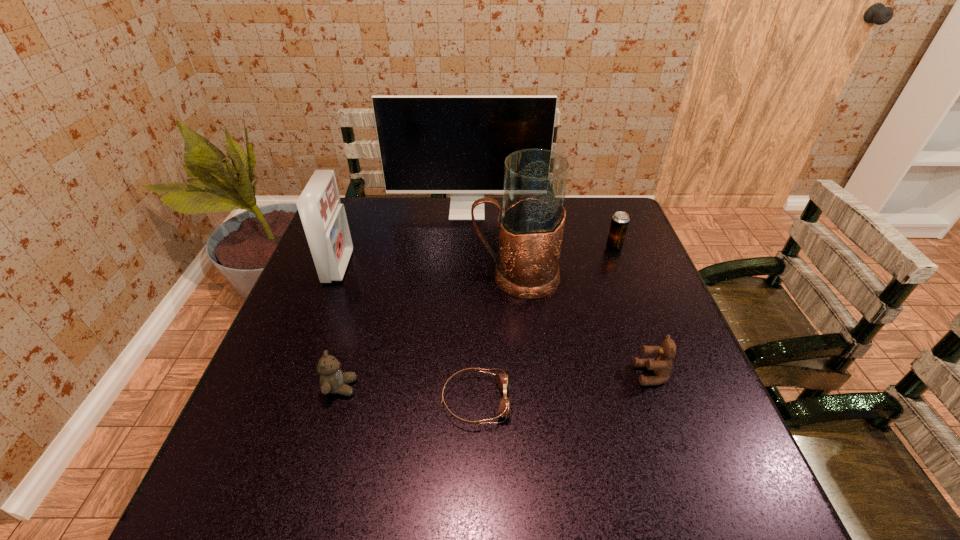
In order to click on the farthest object in this screenshot , I will do `click(428, 144)`.

This screenshot has width=960, height=540. I want to click on pitcher, so click(x=531, y=227).

Locate an element on the screen. The height and width of the screenshot is (540, 960). the leftmost object is located at coordinates coord(323,217).

Locate an element on the screen. This screenshot has height=540, width=960. the first-aid kit is located at coordinates (323, 217).

Find the location of `beer can`. beer can is located at coordinates (620, 220).

I want to click on the right teddy bear, so click(662, 364).

This screenshot has height=540, width=960. I want to click on the left teddy bear, so [332, 379].

The image size is (960, 540). Identify the location of goggles. (502, 380).

The height and width of the screenshot is (540, 960). I want to click on vacant space situated on the front-facing side of the farthest object, so click(465, 267).

At what (x,y) coordinates should I click in order to perform the action: click on vacant space situated with the handle on the side of the pitcher. Please return your answer as a coordinate pair (x, y). Looking at the image, I should click on (367, 276).